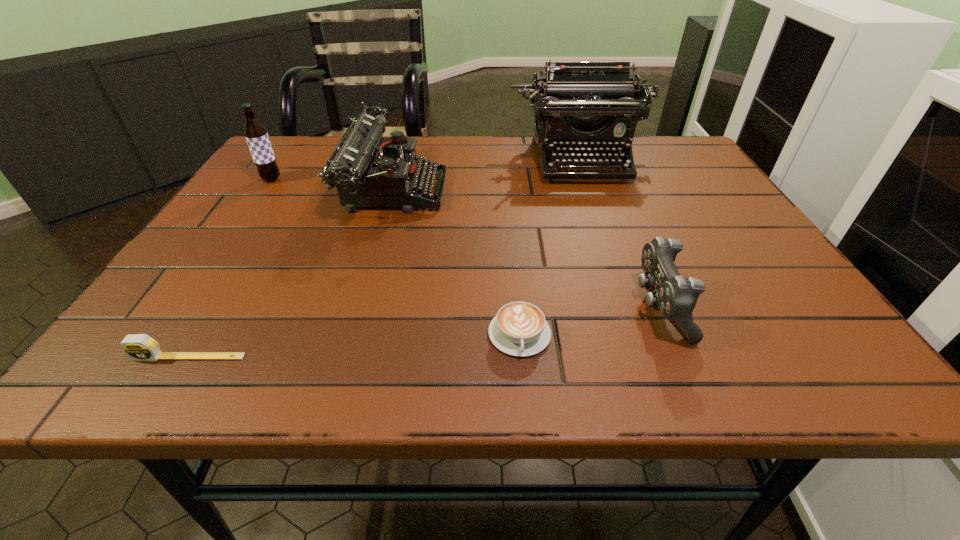
At what (x,y) coordinates should I click in order to perform the action: click on the tallest object. Please return your answer as a coordinate pair (x, y). This screenshot has height=540, width=960. Looking at the image, I should click on (594, 106).

Identify the location of the right typewriter. The height and width of the screenshot is (540, 960). (594, 106).

This screenshot has height=540, width=960. What are the coordinates of `root beer` in the screenshot? It's located at (255, 133).

In order to click on the left typewriter in this screenshot , I will do `click(368, 171)`.

This screenshot has width=960, height=540. I want to click on the third tallest object, so click(x=368, y=171).

Where is `the fourth tallest object`? Image resolution: width=960 pixels, height=540 pixels. the fourth tallest object is located at coordinates (674, 296).

Identify the location of the fifth tallest object. This screenshot has width=960, height=540. (139, 347).

Find the location of a particular element. The height and width of the screenshot is (540, 960). the shortest object is located at coordinates (519, 328).

The width and height of the screenshot is (960, 540). Identify the location of free region located on the keyboard of the right typewriter. (597, 210).

The width and height of the screenshot is (960, 540). I want to click on vacant space located on the back of the root beer, so click(x=300, y=139).